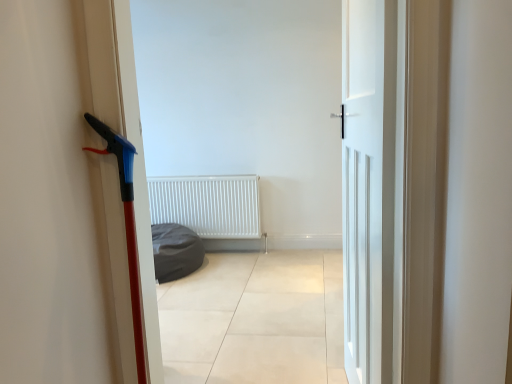
Question: Is dark gray fabric beanbag at center bigger or smaller than white matte radiator at center?

Choices:
 (A) big
 (B) small

Answer: (A)

Question: Is dark gray fabric beanbag at center spatially inside white matte radiator at center, or outside of it?

Choices:
 (A) outside
 (B) inside

Answer: (A)

Question: Based on their relative distances, which object is farther from the white matte door at center?

Choices:
 (A) dark gray fabric beanbag at center
 (B) white matte radiator at center

Answer: (B)

Question: Based on their relative distances, which object is nearer to the white matte radiator at center?

Choices:
 (A) dark gray fabric beanbag at center
 (B) white matte door at center

Answer: (A)